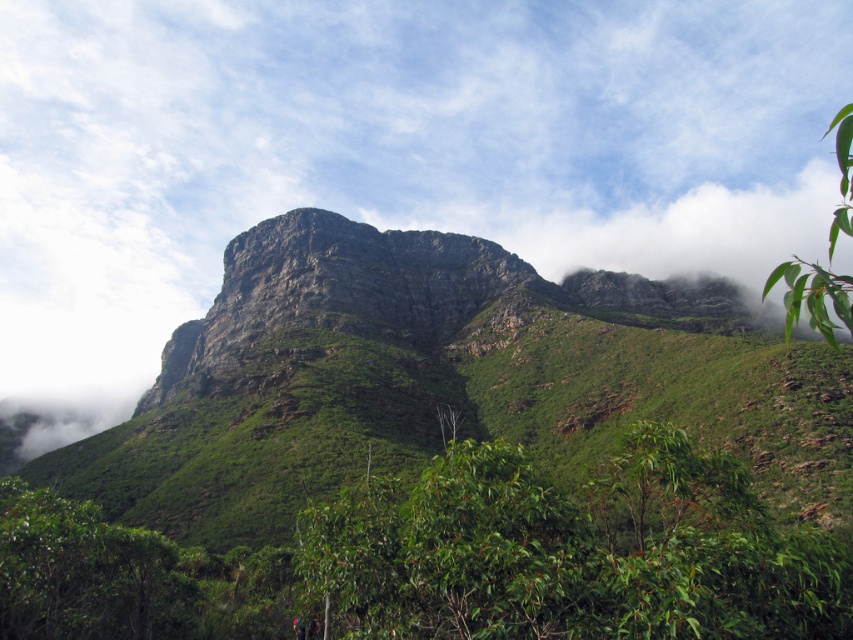
You are standing at the base of the mountain and looking up at the partly cloudy sky. You notice a point marked at coordinates (386, 152). What object is located at that point?

The point at coordinates (386, 152) corresponds to a white fluffy cloud at upper center.

You are an observer looking at the mountain scene. You notice the white fluffy cloud at upper center and the green leafy branch at upper right. Which object is positioned higher in the sky?

The white fluffy cloud at upper center is taller than the green leafy branch at upper right, so it is positioned higher in the sky.

You are an airplane pilot flying over the landscape. You notice the green rocky mountain at center and the white fluffy cloud at upper center. Which object is closer to your current position?

The white fluffy cloud at upper center is closer to your current position because the green rocky mountain at center is behind it.